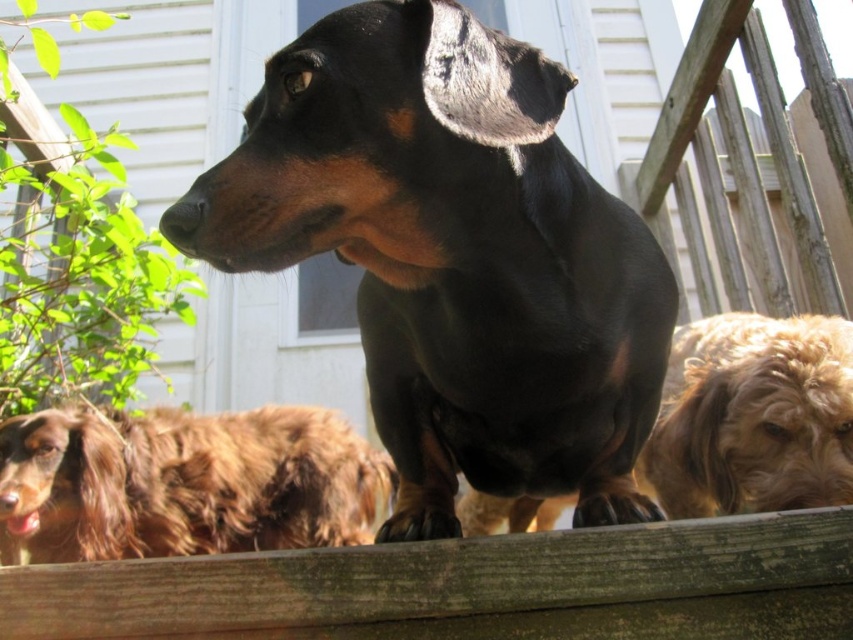
You are a photographer setting up a shoot in the backyard. You need to ensure that the black shiny dog at center and the brown shaggy dog at lower left are both visible in the frame. Based on their positions, which dog is closer to the camera?

The black shiny dog at center is positioned over the brown shaggy dog at lower left, meaning it is closer to the camera.